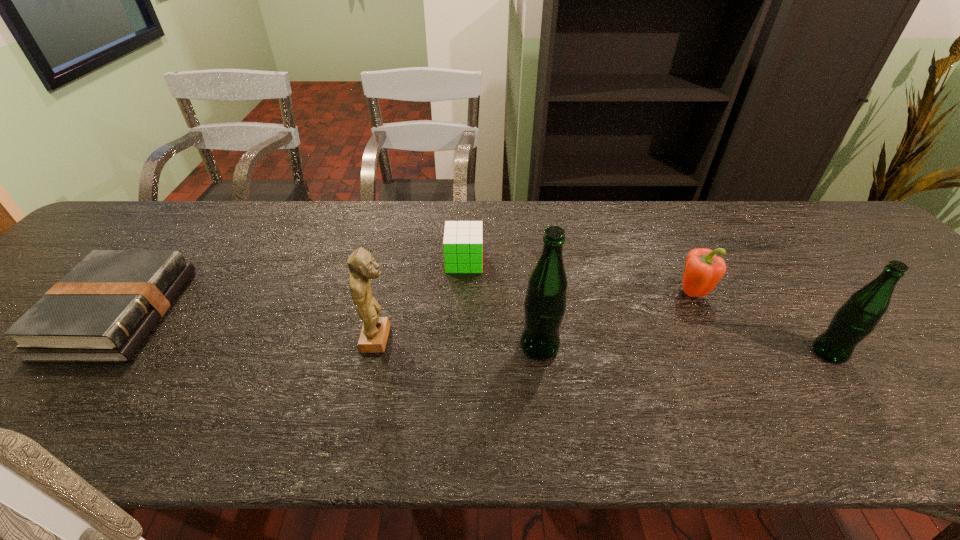
Find the location of a particular element. The height and width of the screenshot is (540, 960). figurine is located at coordinates (375, 330).

Locate an element on the screen. The height and width of the screenshot is (540, 960). vacant space located on the right of the taller beer bottle is located at coordinates (640, 346).

Identify the location of vacant space positioned on the back of the shorter beer bottle. This screenshot has height=540, width=960. (776, 280).

Find the location of a particular element. free point located 0.380m on the left of the third object from left to right is located at coordinates (305, 261).

Where is `vacant space located on the spine side of the shortest object`? Image resolution: width=960 pixels, height=540 pixels. vacant space located on the spine side of the shortest object is located at coordinates (210, 313).

At what (x,y) coordinates should I click in order to perform the action: click on free space located 0.390m on the right of the fourth tallest object. Please return your answer as a coordinate pair (x, y). Looking at the image, I should click on (865, 293).

Identify the location of free space located 0.390m on the front-facing side of the fifth object from right to left. Image resolution: width=960 pixels, height=540 pixels. (566, 339).

What are the coordinates of `object at the left edge` in the screenshot? It's located at (102, 311).

Where is `vacant space at the far edge of the desktop`? The width and height of the screenshot is (960, 540). vacant space at the far edge of the desktop is located at coordinates (526, 245).

What are the coordinates of `free region at the right edge of the desktop` in the screenshot? It's located at (868, 252).